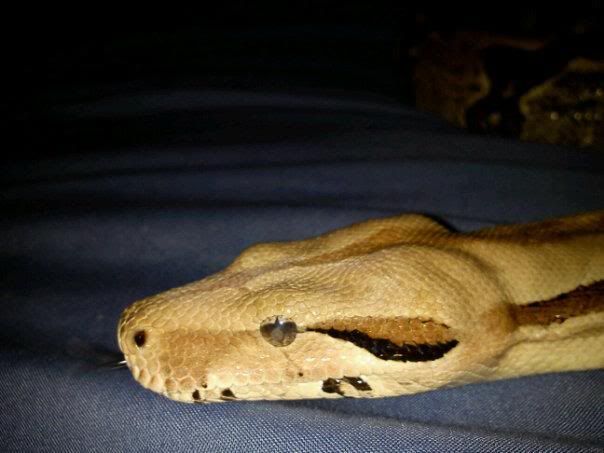
In order to click on waves in fabric in this screenshot , I will do `click(94, 379)`, `click(80, 286)`, `click(146, 231)`, `click(200, 182)`, `click(216, 154)`, `click(238, 103)`.